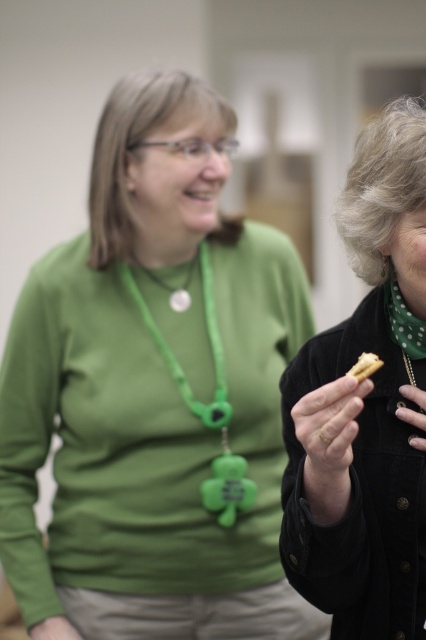
You are a photographer trying to capture a closeup of both the green matte necklace at center and the brown matte cookie at center. Which object should you focus on first if you want to ensure both are in the frame without moving the camera?

The green matte necklace at center is positioned on the left side of the brown matte cookie at center, so you should focus on the green matte necklace at center first to ensure both are in the frame without moving the camera.

You are a jeweler examining two pieces of jewelry in the image. The green matte necklace at center and the metallic gold ring at upper right. Which one do you think has a larger size?

The green matte necklace at center is larger in size than the metallic gold ring at upper right.

You are a person with a 1.5 meter arm reach. You see the brown matte cookie at center in the image. Can you reach it without moving your feet?

The brown matte cookie at center is 1.03 meters away from the viewer. Since your arm reach is 1.5 meters, you can easily reach it without moving your feet.